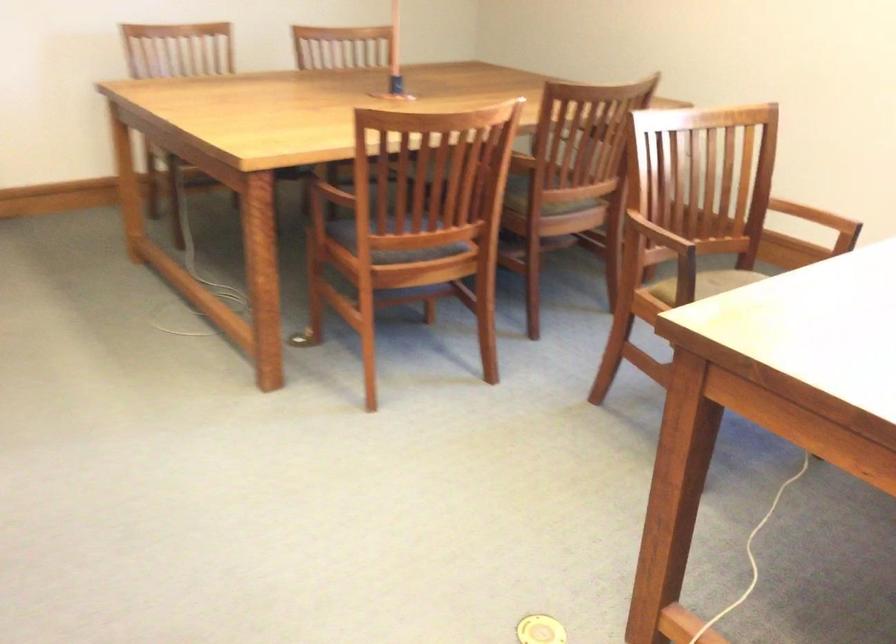
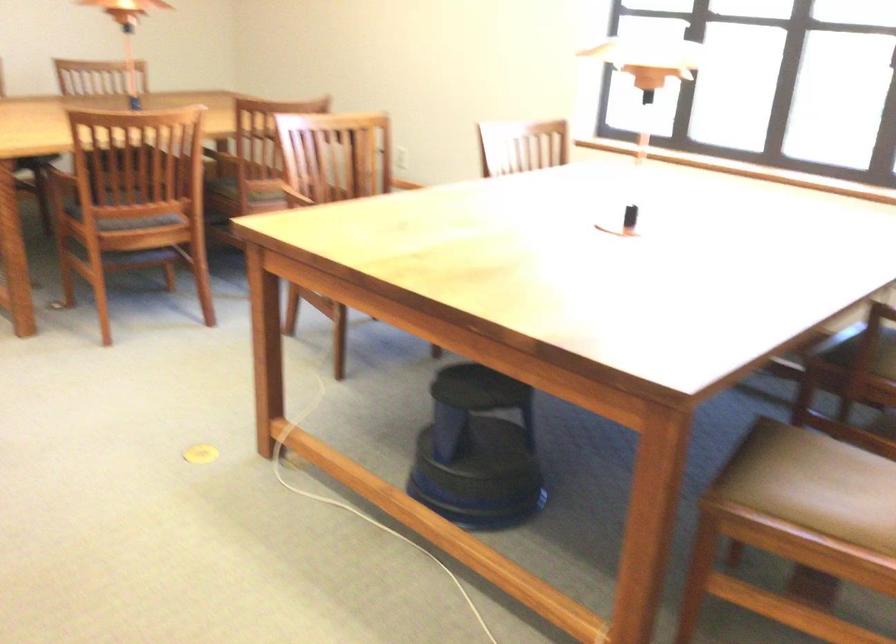
In the second image, find the point that corresponds to the point at 403,243 in the first image.

(128, 209)